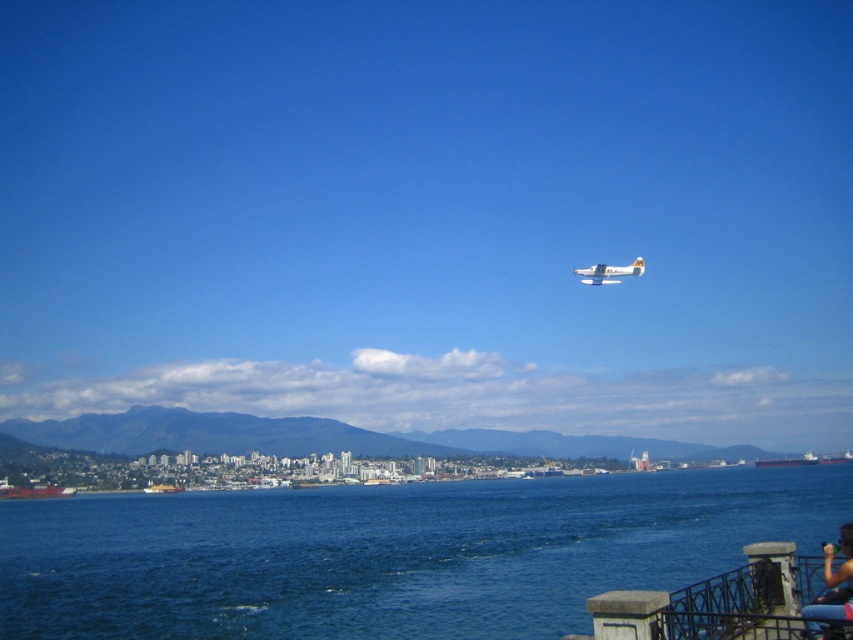
You are a drone operator planning to fly a drone from the black metal railing at lower right to the white matte airplane at upper center. Given that your drone has a maximum flight range of 350 meters, will it be able to reach the airplane without recharging?

The black metal railing at lower right and white matte airplane at upper center are 354.68 meters apart. Since the distance exceeds the drone s 350 meter range, the drone will not be able to reach the airplane without recharging.

You are standing at the point labeled as point (392, 554) in the image. Looking around, you notice blue water at lower center. Which direction should you walk to reach the blue water at lower center?

Since the point labeled as point (392, 554) indicates the blue water at lower center, you are already at the blue water at lower center.

You are standing at the edge of a scenic coastal overlook and see the black metal railing at lower right and the blue denim jeans at lower right. Which object is positioned higher from the ground?

The black metal railing at lower right is above the blue denim jeans at lower right, so it is positioned higher from the ground.